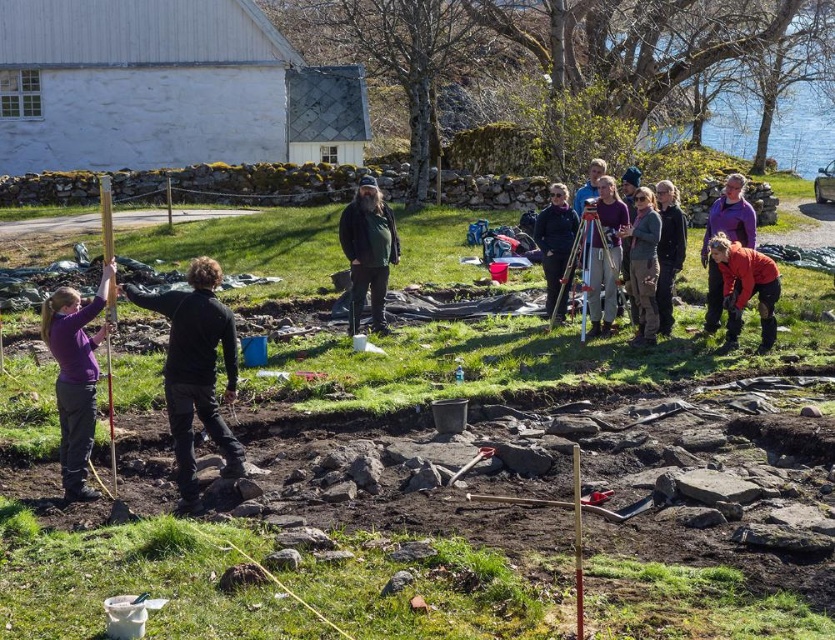
Question: Which point is farther from the camera taking this photo?

Choices:
 (A) (716, 273)
 (B) (763, 280)

Answer: (A)

Question: Which is farther from the purple matte shirt at center-left?

Choices:
 (A) dark brown leather jacket at center
 (B) red matte jacket at lower right
 (C) dark blue jacket at center

Answer: (C)

Question: Is red matte jacket at lower right positioned at the back of dark blue jacket at center?

Choices:
 (A) yes
 (B) no

Answer: (B)

Question: Is black matte jacket at left below purple matte shirt at center-left?

Choices:
 (A) yes
 (B) no

Answer: (B)

Question: Which object is the closest to the dark brown leather jacket at center?

Choices:
 (A) red matte jacket at lower right
 (B) green matte jacket at center
 (C) purple matte shirt at center-left

Answer: (A)

Question: Is green matte jacket at center below dark blue jacket at center?

Choices:
 (A) yes
 (B) no

Answer: (B)